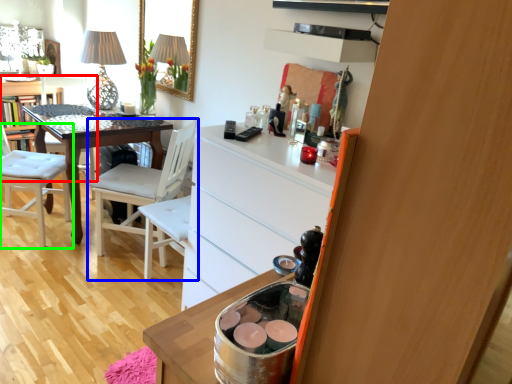
Question: Estimate the real-world distances between objects in this image. Which object is closer to chair (highlighted by a red box), chair (highlighted by a blue box) or chair (highlighted by a green box)?

Choices:
 (A) chair
 (B) chair

Answer: (B)